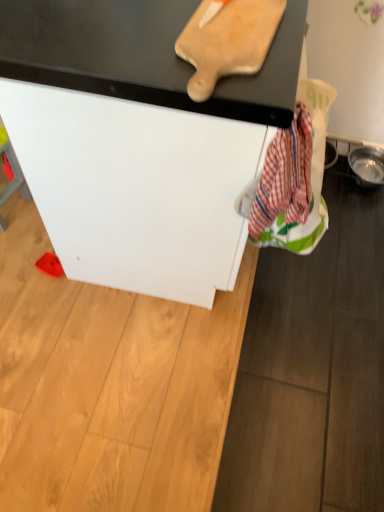
Question: Is wooden cutting board at upper center directly adjacent to red plaid fabric at lower right?

Choices:
 (A) yes
 (B) no

Answer: (B)

Question: Considering the relative sizes of wooden cutting board at upper center and red plaid fabric at lower right in the image provided, is wooden cutting board at upper center smaller than red plaid fabric at lower right?

Choices:
 (A) no
 (B) yes

Answer: (B)

Question: From a real-world perspective, is wooden cutting board at upper center beneath red plaid fabric at lower right?

Choices:
 (A) no
 (B) yes

Answer: (A)

Question: Is wooden cutting board at upper center outside red plaid fabric at lower right?

Choices:
 (A) yes
 (B) no

Answer: (A)

Question: Is wooden cutting board at upper center oriented away from red plaid fabric at lower right?

Choices:
 (A) no
 (B) yes

Answer: (A)

Question: Looking at the image, does red plaid fabric at lower right seem bigger or smaller compared to white matte cabinet at center?

Choices:
 (A) small
 (B) big

Answer: (A)

Question: From the image's perspective, relative to white matte cabinet at center, is red plaid fabric at lower right above or below?

Choices:
 (A) below
 (B) above

Answer: (A)

Question: From a real-world perspective, is red plaid fabric at lower right above or below white matte cabinet at center?

Choices:
 (A) below
 (B) above

Answer: (B)

Question: Is point [x=306, y=253] positioned closer to the camera than point [x=230, y=95]?

Choices:
 (A) farther
 (B) closer

Answer: (A)

Question: Is white matte cabinet at center bigger or smaller than red plaid fabric at lower right?

Choices:
 (A) big
 (B) small

Answer: (A)

Question: Is white matte cabinet at center wider or thinner than red plaid fabric at lower right?

Choices:
 (A) wide
 (B) thin

Answer: (A)

Question: Considering the positions of point (158, 247) and point (322, 224), is point (158, 247) closer or farther from the camera than point (322, 224)?

Choices:
 (A) farther
 (B) closer

Answer: (B)

Question: In terms of height, does white matte cabinet at center look taller or shorter compared to red plaid fabric at lower right?

Choices:
 (A) tall
 (B) short

Answer: (A)

Question: Visually, is wooden cutting board at upper center positioned to the left or to the right of white matte cabinet at center?

Choices:
 (A) right
 (B) left

Answer: (A)

Question: From their relative heights in the image, would you say wooden cutting board at upper center is taller or shorter than white matte cabinet at center?

Choices:
 (A) short
 (B) tall

Answer: (A)